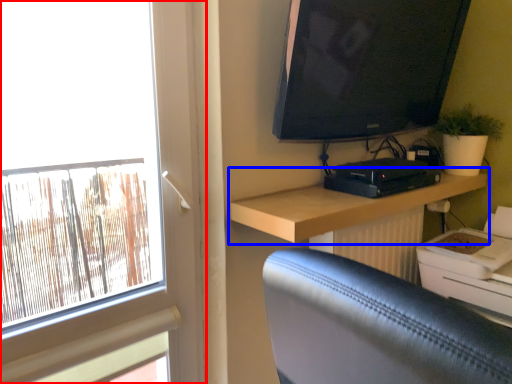
Question: Which of the following is the farthest to the observer, window (highlighted by a red box) or shelf (highlighted by a blue box)?

Choices:
 (A) window
 (B) shelf

Answer: (B)